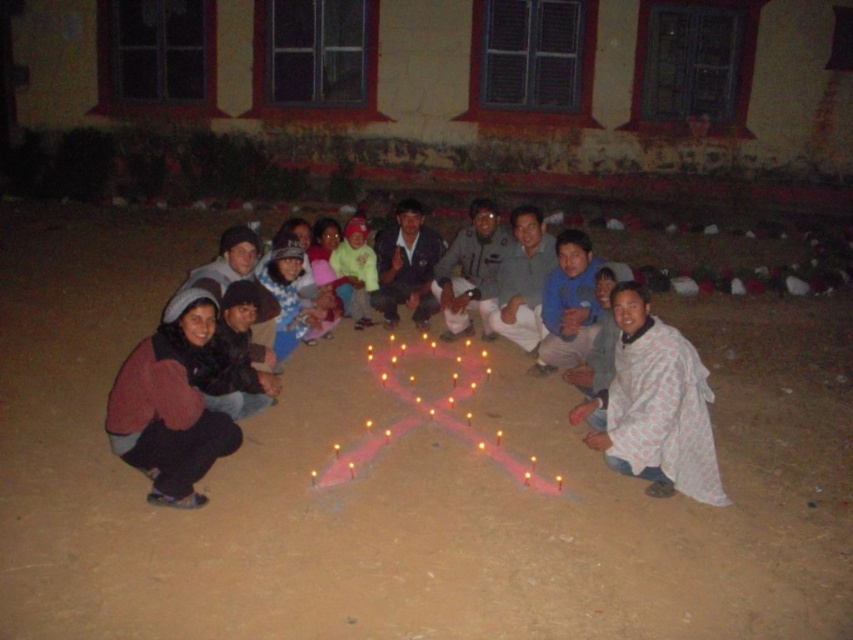
Based on the photo, you are a photographer at the scene. You need to place a small tripod to capture the group without blocking the candles. The tripod must be placed at a position that is not occupied by any object and is at least 0.5 meters away from the group. The coordinate system is normalized, where the bottom left corner is the origin. The white printed cloth at lower right is located at point (654,406). Where can you place the tripod?

The white printed cloth at lower right is at point (654,406). To place the tripod at least 0.5 meters away from the group and not on the cloth, consider coordinates outside the group area and away from (654,406). For example, placing it near the lower left corner or upper middle areas might work, ensuring it stays clear of occupied spots.

You are a photographer trying to adjust the lighting for the group photo. You have a reflector made of white printed cloth at lower right and a light yellow fabric at center. Which fabric should you move closer to the candles to better reflect light onto the group?

The light yellow fabric at center should be moved closer to the candles because the white printed cloth at lower right is already positioned to the right of it, making the light yellow fabric more centrally located to effectively reflect light onto the group.